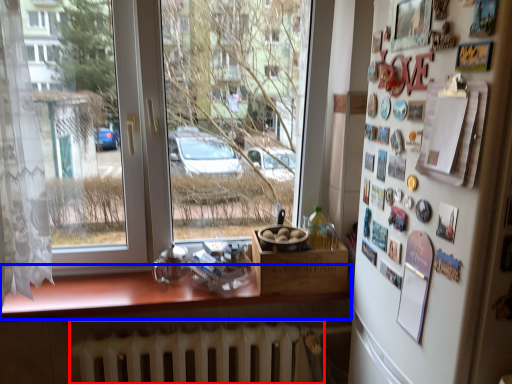
Question: Which object appears farthest to the camera in this image, radiator (highlighted by a red box) or counter top (highlighted by a blue box)?

Choices:
 (A) radiator
 (B) counter top

Answer: (A)